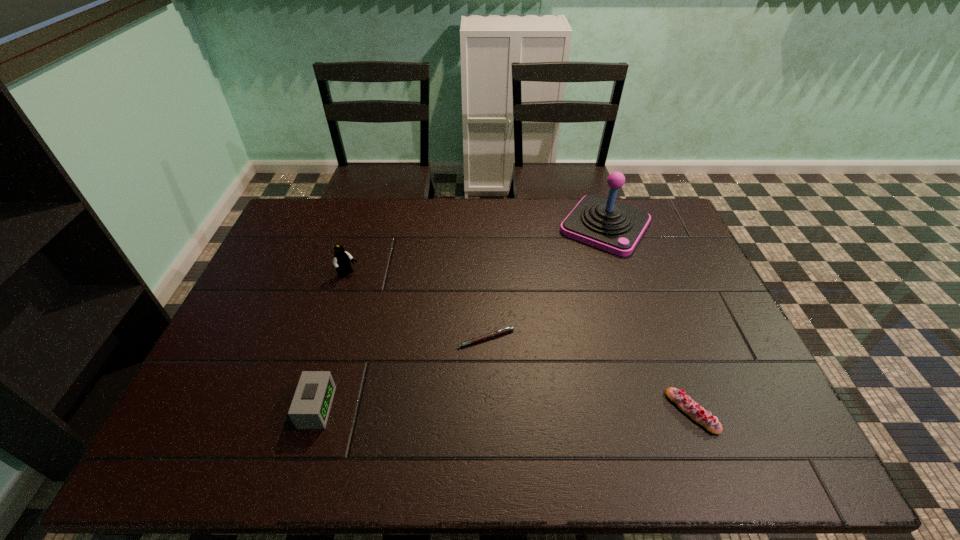
At what (x,y) coordinates should I click in order to perform the action: click on free space at the far right corner of the desktop. Please return your answer as a coordinate pair (x, y). Image resolution: width=960 pixels, height=540 pixels. Looking at the image, I should click on pos(661,213).

The width and height of the screenshot is (960, 540). I want to click on empty space that is in between the Lego and the joystick, so click(x=476, y=251).

At what (x,y) coordinates should I click in order to perform the action: click on free space between the eclair and the third shortest object. Please return your answer as a coordinate pair (x, y). The height and width of the screenshot is (540, 960). Looking at the image, I should click on (504, 409).

You are a GUI agent. You are given a task and a screenshot of the screen. Output one action in this format:
    pyautogui.click(x=<x>, y=<y>)
    Task: Click on the free space between the third shortest object and the shortest object
    
    Given the screenshot: What is the action you would take?
    pyautogui.click(x=401, y=373)

At what (x,y) coordinates should I click in order to perform the action: click on free spot between the tallest object and the third nearest object. Please return your answer as a coordinate pair (x, y). The image size is (960, 540). Looking at the image, I should click on (545, 282).

Image resolution: width=960 pixels, height=540 pixels. In order to click on free point between the tallest object and the alarm clock in this screenshot , I will do `click(461, 317)`.

Identify the location of vacant area that lies between the third object from left to right and the second shortest object. (588, 375).

The image size is (960, 540). I want to click on vacant space that is in between the fourth shortest object and the fourth tallest object, so point(520,343).

Locate an element on the screen. free spot between the alarm clock and the third farthest object is located at coordinates (401, 373).

Where is `vacant area between the joystick and the third object from right to left`? The image size is (960, 540). vacant area between the joystick and the third object from right to left is located at coordinates (545, 282).